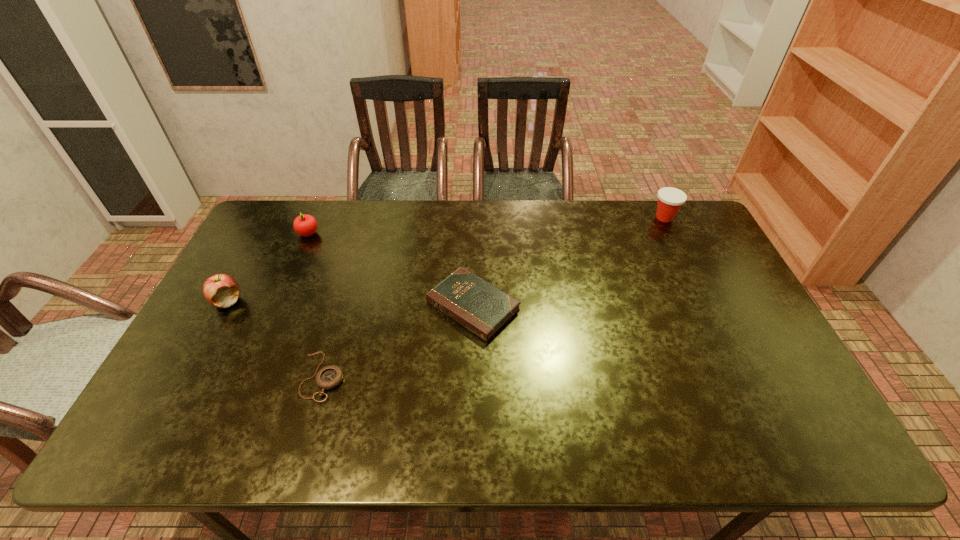
Locate an element on the screen. The image size is (960, 540). the farthest object is located at coordinates (670, 200).

Find the location of a particular element. the rightmost object is located at coordinates point(670,200).

Image resolution: width=960 pixels, height=540 pixels. I want to click on the nearer apple, so click(x=221, y=290).

The height and width of the screenshot is (540, 960). What are the coordinates of `the leftmost object` in the screenshot? It's located at (221, 290).

The height and width of the screenshot is (540, 960). I want to click on the right apple, so click(305, 225).

You are a GUI agent. You are given a task and a screenshot of the screen. Output one action in this format:
    pyautogui.click(x=<x>, y=<y>)
    Task: Click on the farther apple
    The width and height of the screenshot is (960, 540).
    Given the screenshot: What is the action you would take?
    pyautogui.click(x=305, y=225)

This screenshot has width=960, height=540. What are the coordinates of `the second object from right to left` in the screenshot? It's located at (482, 308).

The image size is (960, 540). Find the location of `Bible`. Bible is located at coordinates (482, 308).

Where is `the third object from left to right`? the third object from left to right is located at coordinates (329, 377).

Where is `the shortest object`? the shortest object is located at coordinates (329, 377).